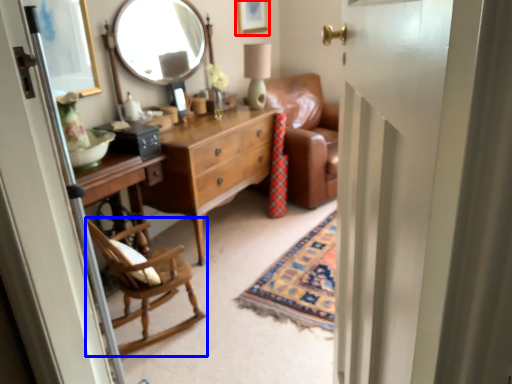
Question: Among these objects, which one is nearest to the camera, picture frame (highlighted by a red box) or chair (highlighted by a blue box)?

Choices:
 (A) picture frame
 (B) chair

Answer: (B)